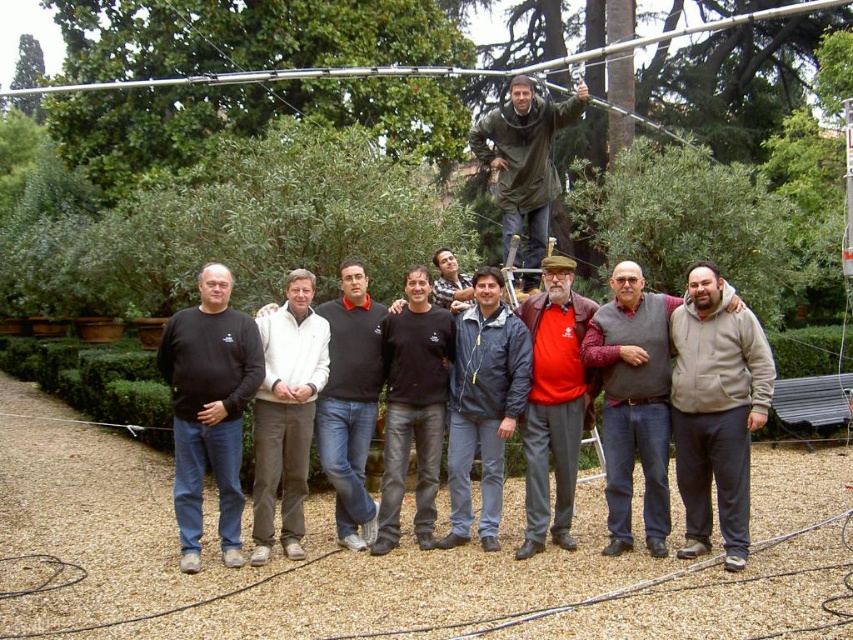
You are a photographer standing at the location of the camera. You want to take a photo of the dark blue jacket at center. Can you fit the entire jacket into your camera frame if your camera has a maximum viewing angle of 60 degrees? Assume the camera is at eye level with the jacket.

The dark blue jacket at center and camera are 7.92 meters apart. To determine if the entire jacket can fit into the camera frame with a 60 degree viewing angle, we need to calculate the field of view. Using trigonometry, the maximum distance for the jacket to fit would be half the jacket height divided by tan 30 degrees. However, without knowing the jacket height, we cannot definitively answer. The question lacks sufficient information about the jacket size.

You are taking a photo of the group in the garden. The photographer wants to ensure the dark blue jacket at center is visible in the frame. Based on its position, where should the photographer focus the camera?

The dark blue jacket at center is located at point (483, 404), so the photographer should focus the camera at that coordinate to ensure it is visible in the frame.

From the picture: You are taking a photo of the group in the garden. Where is the person wearing the gray sweater at center positioned relative to the others?

The gray sweater at center is located at point (x=633, y=403), which means it is positioned towards the center of the image both horizontally and vertically.